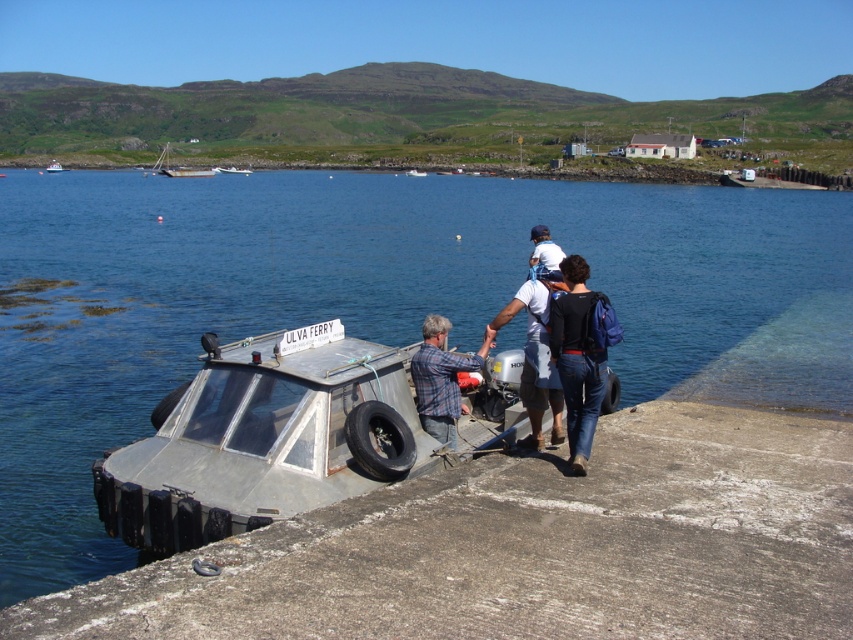
You are a photographer positioned at the point with coordinates [440,380] in the image. You want to capture a photo of the plaid fabric shirt at center. Is the plaid fabric shirt at center located exactly at your current position?

The plaid fabric shirt at center is located exactly at the point with coordinates [440,380], so yes, it is at your current position.

You are a photographer positioned at the end of the dock. You want to take a photo of the rusty metal boat at upper center without including the plaid fabric shirt at center in the frame. Is this possible based on their positions?

The plaid fabric shirt at center is closer to the viewer than the rusty metal boat at upper center. Since the shirt is in front, it would block the view of the boat unless you move to a different angle or position to exclude it.